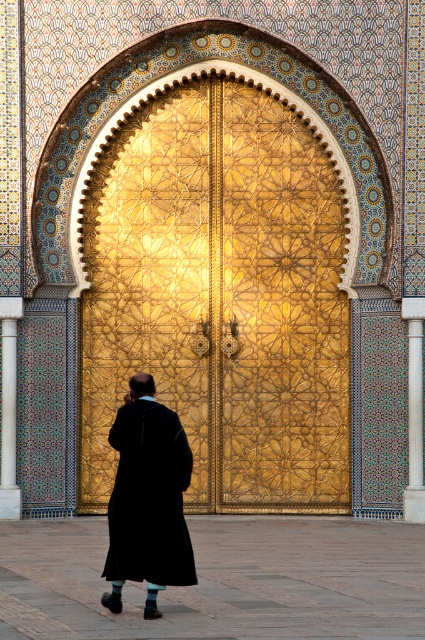
You are standing in front of the grand entrance and want to touch the gold textured door at center and the white marble pillar at right. Which object will you reach first?

You will reach the gold textured door at center first because it is closer to you than the white marble pillar at right, which is further away.

You are an architect designing a new building and want to ensure accessibility for wheelchairs. The wheelchair requires a minimum of 12 meters of clearance between the gold textured door at center and the white marble pillar at right. Based on the image, is the existing space sufficient?

The gold textured door at center and the white marble pillar at right are 12.83 meters apart, which exceeds the required 12 meters. Therefore, the existing space is sufficient for wheelchair accessibility.

You are standing in front of the golden door and notice both the black woolen robe at center and the polished marble pillar at center. Which object is nearer to you?

The black woolen robe at center is closer to the viewer than the polished marble pillar at center.